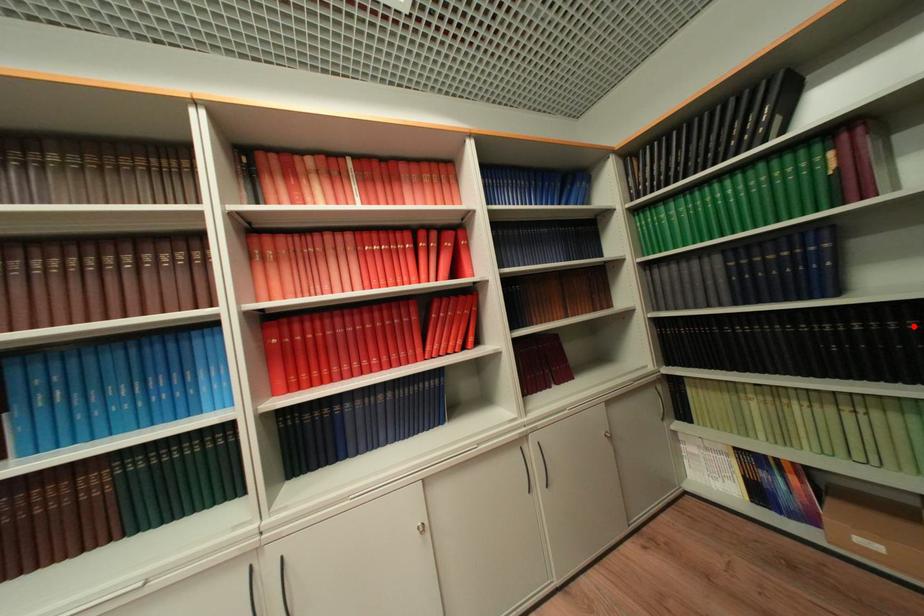
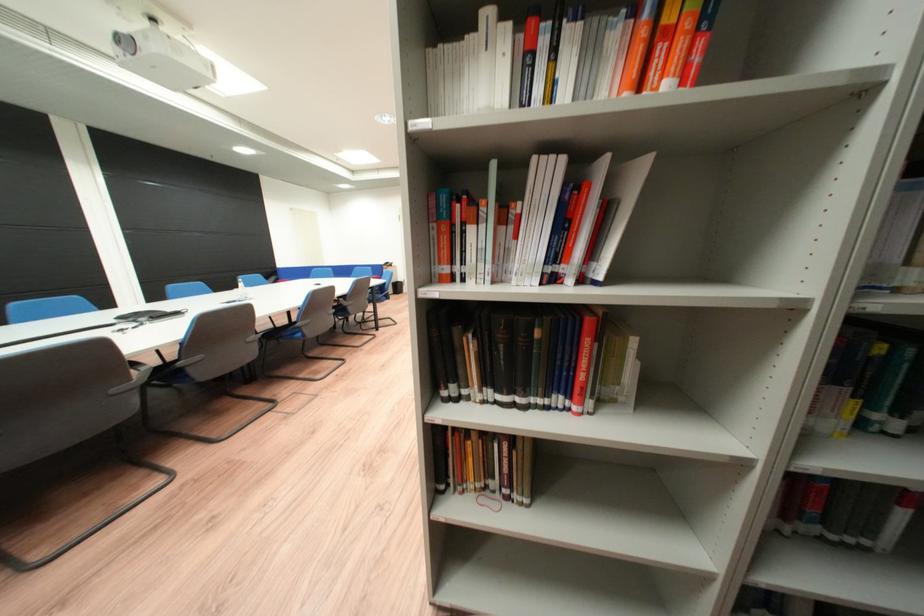
Question: I am providing you with two images of the same scene from different viewpoints. A red point is marked on the first image. Can you still see the location of the red point in image 2?

Choices:
 (A) Yes
 (B) No

Answer: (B)